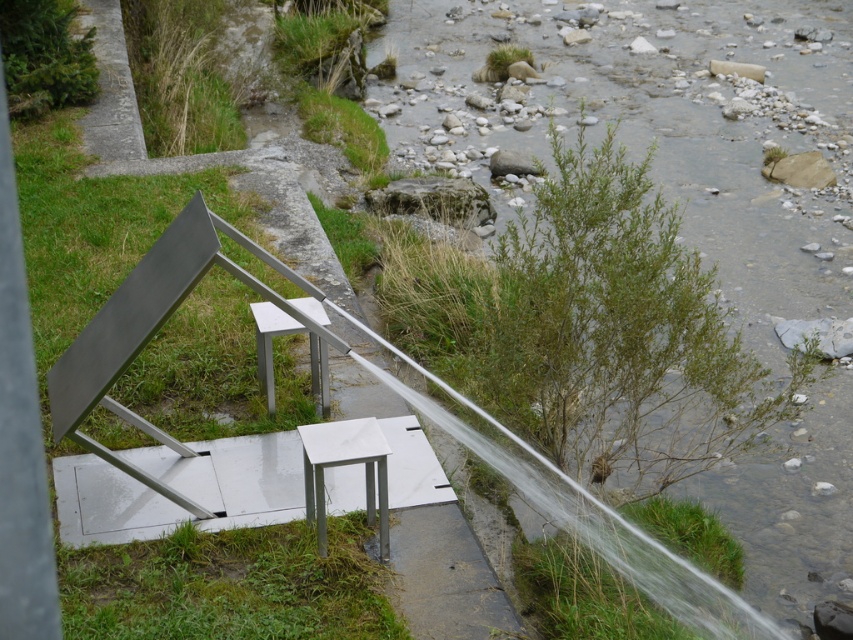
Question: Can you confirm if white marble stool at center is positioned below metallic silver stool at center?

Choices:
 (A) yes
 (B) no

Answer: (A)

Question: Which of the following is the farthest from the observer?

Choices:
 (A) white marble stool at center
 (B) metallic silver stool at center

Answer: (B)

Question: Observing the image, what is the correct spatial positioning of white marble stool at center in reference to metallic silver stool at center?

Choices:
 (A) left
 (B) right

Answer: (B)

Question: Is white marble stool at center smaller than metallic silver stool at center?

Choices:
 (A) no
 (B) yes

Answer: (B)